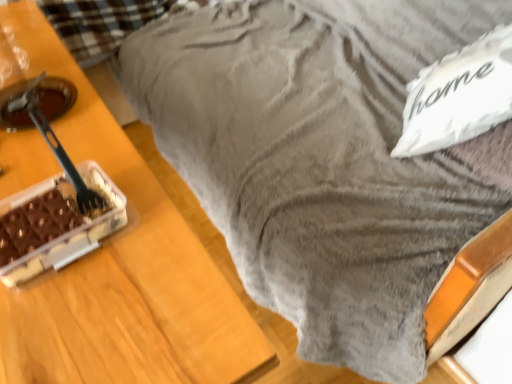
What are the coordinates of `free space in front of black plastic fork at left` in the screenshot? It's located at (89, 300).